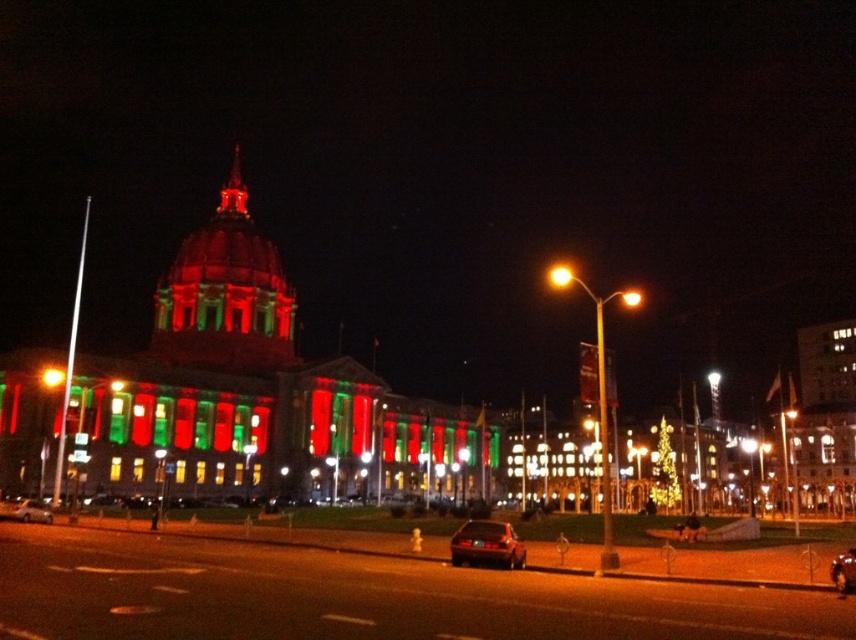
Can you confirm if shiny black sedan at lower center is positioned above metallic silver car at center?

Actually, shiny black sedan at lower center is below metallic silver car at center.

Does shiny black sedan at lower center appear on the left side of metallic silver car at center?

Incorrect, shiny black sedan at lower center is not on the left side of metallic silver car at center.

Who is more forward, (459, 563) or (39, 516)?

Point (459, 563) is in front.

Find the location of a particular element. The width and height of the screenshot is (856, 640). shiny black sedan at lower center is located at coordinates (486, 545).

Who is positioned more to the left, shiny black sedan at lower center or shiny metallic car at center?

shiny black sedan at lower center

Describe the element at coordinates (486, 545) in the screenshot. The width and height of the screenshot is (856, 640). I see `shiny black sedan at lower center` at that location.

Which is behind, point (516, 538) or point (846, 572)?

The point (516, 538) is more distant.

This screenshot has height=640, width=856. In order to click on shiny black sedan at lower center in this screenshot , I will do `click(486, 545)`.

Between metallic silver car at center and shiny metallic car at center, which one appears on the right side from the viewer's perspective?

shiny metallic car at center

Between point (24, 518) and point (841, 561), which one is positioned behind?

Positioned behind is point (24, 518).

You are a GUI agent. You are given a task and a screenshot of the screen. Output one action in this format:
    pyautogui.click(x=<x>, y=<y>)
    Task: Click on the metallic silver car at center
    The height and width of the screenshot is (640, 856).
    Given the screenshot: What is the action you would take?
    pyautogui.click(x=25, y=509)

Find the location of a particular element. The image size is (856, 640). metallic silver car at center is located at coordinates (25, 509).